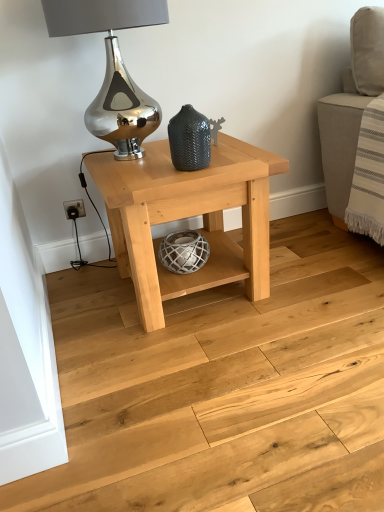
Locate an element on the screen. The height and width of the screenshot is (512, 384). free space above natural wood floor at center (from a real-world perspective) is located at coordinates (216, 359).